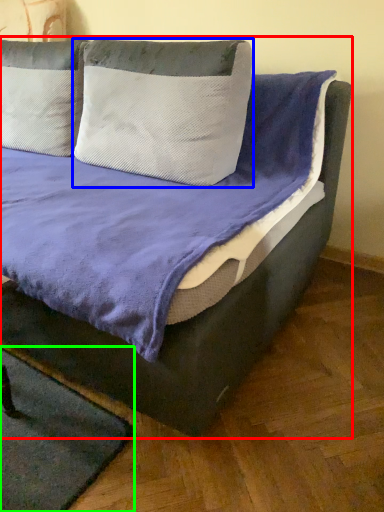
Question: Which object is positioned closest to bed (highlighted by a red box)? Select from pillow (highlighted by a blue box) and mat (highlighted by a green box).

Choices:
 (A) pillow
 (B) mat

Answer: (A)